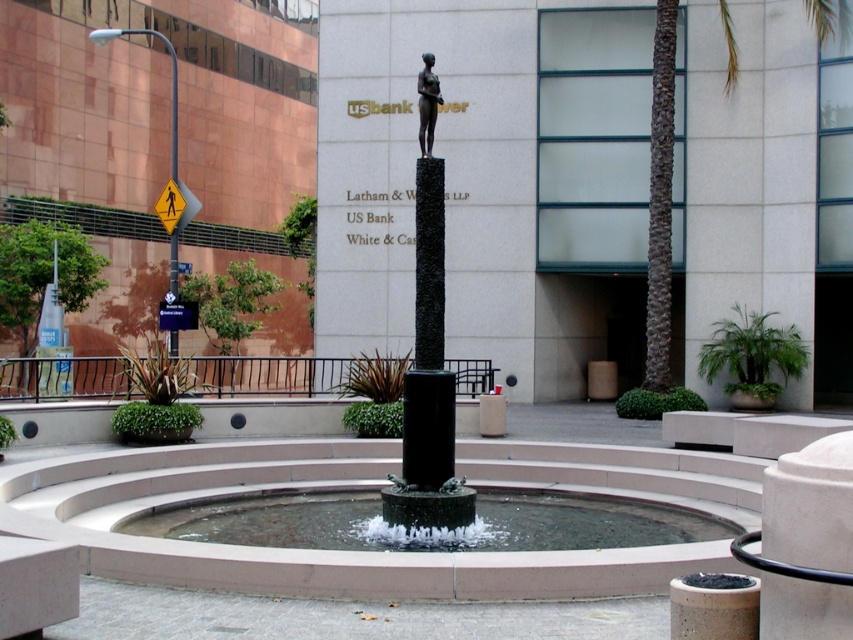
Is clear glass water at center bigger than bronze statue at center?

Actually, clear glass water at center might be smaller than bronze statue at center.

Between point (285, 500) and point (421, 154), which one is positioned behind?

The point (421, 154) is more distant.

This screenshot has height=640, width=853. In order to click on clear glass water at center in this screenshot , I will do [428, 528].

Is bronze statue at center thinner than metallic reflective street sign at center?

No.

What are the coordinates of `bronze statue at center` in the screenshot? It's located at coord(427,104).

Find the location of a particular element. This screenshot has width=853, height=640. bronze statue at center is located at coordinates (427, 104).

In the scene shown: Does yellow reflective plastic pedestrian sign at upper left have a lesser height compared to metallic reflective street sign at center?

Incorrect, yellow reflective plastic pedestrian sign at upper left's height does not fall short of metallic reflective street sign at center's.

Find the location of `yellow reflective plastic pedestrian sign at upper left`. yellow reflective plastic pedestrian sign at upper left is located at coordinates (175, 205).